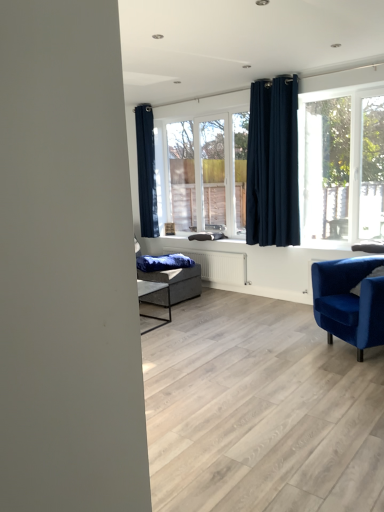
Question: Is clear glass window at center bigger than dark blue fabric curtain at upper left, which ranks as the first curtain in back-to-front order?

Choices:
 (A) no
 (B) yes

Answer: (B)

Question: Does clear glass window at center have a greater height compared to dark blue fabric curtain at upper left, which appears as the second curtain when viewed from the front?

Choices:
 (A) no
 (B) yes

Answer: (A)

Question: Is clear glass window at center at the right side of dark blue fabric curtain at upper left, arranged as the 1th curtain when viewed from the left?

Choices:
 (A) no
 (B) yes

Answer: (B)

Question: Is clear glass window at center to the left of dark blue fabric curtain at upper left, arranged as the 2th curtain when viewed from the right, from the viewer's perspective?

Choices:
 (A) yes
 (B) no

Answer: (B)

Question: Considering the relative sizes of clear glass window at center and dark blue fabric curtain at upper left, which ranks as the first curtain in back-to-front order, in the image provided, is clear glass window at center thinner than dark blue fabric curtain at upper left, which ranks as the first curtain in back-to-front order,?

Choices:
 (A) yes
 (B) no

Answer: (A)

Question: From a real-world perspective, does clear glass window at center sit lower than dark blue fabric curtain at upper left, which appears as the second curtain when viewed from the front?

Choices:
 (A) yes
 (B) no

Answer: (A)

Question: Would you say velvet blue armchair at lower right contains clear glass window at center?

Choices:
 (A) yes
 (B) no

Answer: (B)

Question: From a real-world perspective, is velvet blue armchair at lower right over clear glass window at center?

Choices:
 (A) yes
 (B) no

Answer: (B)

Question: Is velvet blue armchair at lower right further to the viewer compared to clear glass window at center?

Choices:
 (A) yes
 (B) no

Answer: (B)

Question: From the image's perspective, is velvet blue armchair at lower right located beneath clear glass window at center?

Choices:
 (A) no
 (B) yes

Answer: (B)

Question: Can you confirm if velvet blue armchair at lower right is smaller than clear glass window at center?

Choices:
 (A) no
 (B) yes

Answer: (A)

Question: Is velvet blue armchair at lower right at the right side of clear glass window at center?

Choices:
 (A) no
 (B) yes

Answer: (B)

Question: Is the position of clear glass window at center less distant than that of velvet blue armchair at lower right?

Choices:
 (A) no
 (B) yes

Answer: (A)